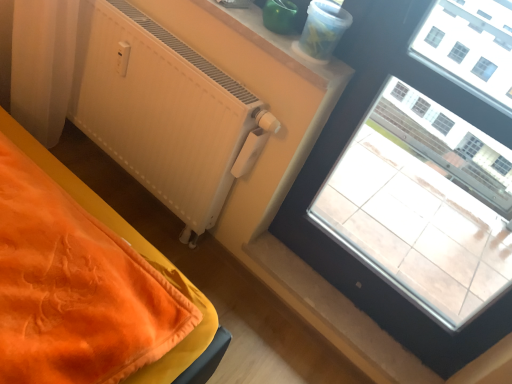
Question: From the image's perspective, is smooth plastic container at upper center on top of transparent glass window at upper right?

Choices:
 (A) yes
 (B) no

Answer: (A)

Question: Is smooth plastic container at upper center bigger than transparent glass window at upper right?

Choices:
 (A) yes
 (B) no

Answer: (B)

Question: Can you confirm if smooth plastic container at upper center is positioned to the left of transparent glass window at upper right?

Choices:
 (A) no
 (B) yes

Answer: (B)

Question: Does smooth plastic container at upper center lie in front of transparent glass window at upper right?

Choices:
 (A) no
 (B) yes

Answer: (A)

Question: Are smooth plastic container at upper center and transparent glass window at upper right located far from each other?

Choices:
 (A) yes
 (B) no

Answer: (B)

Question: From the image's perspective, is transparent glass window at upper right positioned above or below white matte radiator at upper left?

Choices:
 (A) below
 (B) above

Answer: (A)

Question: Based on their sizes in the image, would you say transparent glass window at upper right is bigger or smaller than white matte radiator at upper left?

Choices:
 (A) small
 (B) big

Answer: (A)

Question: Would you say transparent glass window at upper right is inside or outside white matte radiator at upper left?

Choices:
 (A) inside
 (B) outside

Answer: (B)

Question: From their relative heights in the image, would you say transparent glass window at upper right is taller or shorter than white matte radiator at upper left?

Choices:
 (A) tall
 (B) short

Answer: (A)

Question: From the image's perspective, is white matte radiator at upper left positioned above or below smooth plastic container at upper center?

Choices:
 (A) above
 (B) below

Answer: (B)

Question: In terms of height, does white matte radiator at upper left look taller or shorter compared to smooth plastic container at upper center?

Choices:
 (A) tall
 (B) short

Answer: (A)

Question: Is white matte radiator at upper left inside or outside of smooth plastic container at upper center?

Choices:
 (A) outside
 (B) inside

Answer: (A)

Question: Is white matte radiator at upper left wider or thinner than smooth plastic container at upper center?

Choices:
 (A) wide
 (B) thin

Answer: (B)

Question: In the image, is smooth plastic container at upper center positioned in front of or behind transparent glass window at upper right?

Choices:
 (A) front
 (B) behind

Answer: (B)

Question: Choose the correct answer: Is smooth plastic container at upper center inside transparent glass window at upper right or outside it?

Choices:
 (A) outside
 (B) inside

Answer: (A)